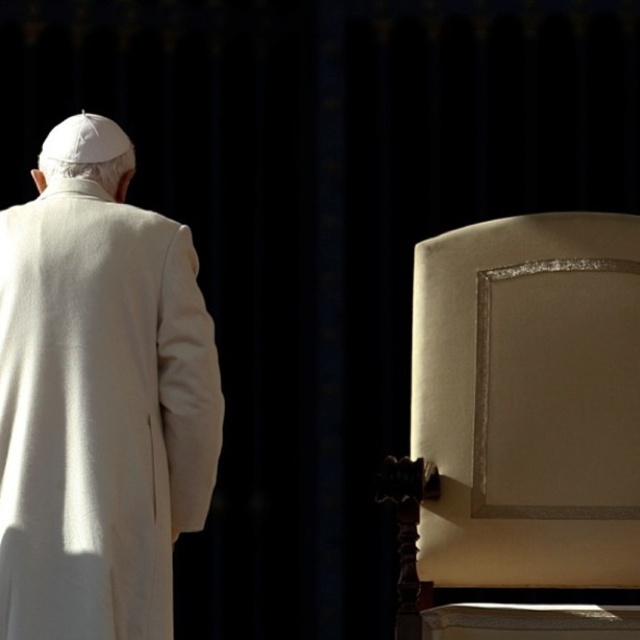
Question: Does satin beige chair at right have a smaller size compared to white wool coat at upper left?

Choices:
 (A) no
 (B) yes

Answer: (B)

Question: Is satin beige chair at right to the left of white wool coat at upper left from the viewer's perspective?

Choices:
 (A) no
 (B) yes

Answer: (A)

Question: Does satin beige chair at right have a greater width compared to white wool coat at upper left?

Choices:
 (A) yes
 (B) no

Answer: (A)

Question: Among these points, which one is farthest from the camera?

Choices:
 (A) (125, 193)
 (B) (461, 577)

Answer: (B)

Question: Which point appears closest to the camera in this image?

Choices:
 (A) (116, 214)
 (B) (628, 321)

Answer: (A)